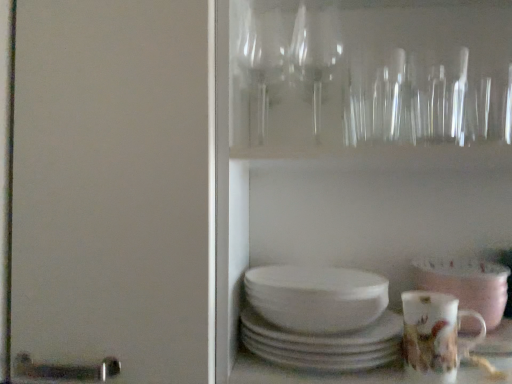
Question: Is white glossy plates at center wider than white glossy bowl at lower right?

Choices:
 (A) no
 (B) yes

Answer: (B)

Question: From a real-world perspective, is white glossy plates at center beneath white glossy bowl at lower right?

Choices:
 (A) yes
 (B) no

Answer: (A)

Question: Can you confirm if white glossy plates at center is smaller than white glossy bowl at lower right?

Choices:
 (A) no
 (B) yes

Answer: (A)

Question: Is white glossy plates at center closer to camera compared to white glossy bowl at lower right?

Choices:
 (A) no
 (B) yes

Answer: (B)

Question: Is white glossy bowl at lower right at the back of white glossy plates at center?

Choices:
 (A) yes
 (B) no

Answer: (B)

Question: Could white glossy bowl at lower right be considered to be inside white glossy plates at center?

Choices:
 (A) no
 (B) yes

Answer: (A)

Question: From the image's perspective, is porcelain floral mug at lower right on top of white glossy plates at center?

Choices:
 (A) yes
 (B) no

Answer: (B)

Question: From a real-world perspective, is porcelain floral mug at lower right over white glossy plates at center?

Choices:
 (A) no
 (B) yes

Answer: (A)

Question: Is porcelain floral mug at lower right positioned before white glossy plates at center?

Choices:
 (A) no
 (B) yes

Answer: (A)

Question: Can you confirm if porcelain floral mug at lower right is positioned to the left of white glossy plates at center?

Choices:
 (A) yes
 (B) no

Answer: (B)

Question: Is porcelain floral mug at lower right to the right of white glossy plates at center from the viewer's perspective?

Choices:
 (A) yes
 (B) no

Answer: (A)

Question: Is porcelain floral mug at lower right facing towards white glossy plates at center?

Choices:
 (A) no
 (B) yes

Answer: (A)

Question: Does white glossy bowl at lower right have a smaller size compared to porcelain floral mug at lower right?

Choices:
 (A) yes
 (B) no

Answer: (B)